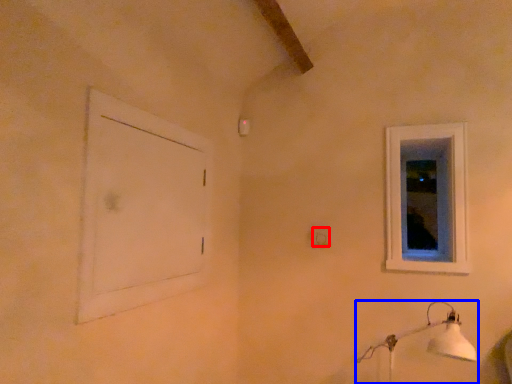
Question: Which object appears closest to the camera in this image, electric outlet (highlighted by a red box) or lamp (highlighted by a blue box)?

Choices:
 (A) electric outlet
 (B) lamp

Answer: (B)